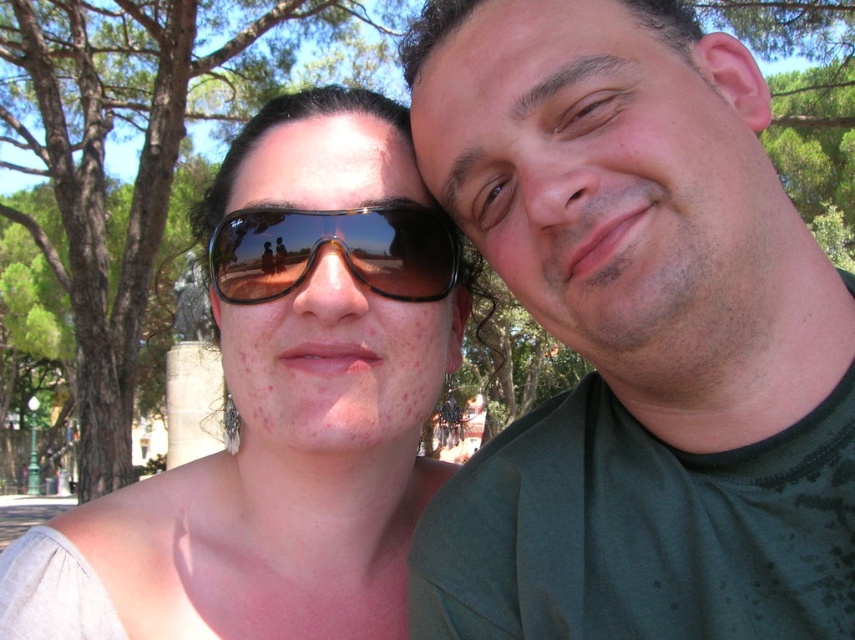
Question: Does green matte shirt at right appear under matte black sunglasses at upper left?

Choices:
 (A) no
 (B) yes

Answer: (A)

Question: Which point is closer to the camera?

Choices:
 (A) green matte shirt at right
 (B) matte black sunglasses at upper left
 (C) shiny black goggles at center

Answer: (A)

Question: Can you confirm if green matte shirt at right is positioned to the left of matte black sunglasses at upper left?

Choices:
 (A) yes
 (B) no

Answer: (B)

Question: Which of these objects is positioned closest to the shiny black goggles at center?

Choices:
 (A) green matte shirt at right
 (B) matte black sunglasses at upper left

Answer: (B)

Question: Is green matte shirt at right further to camera compared to shiny black goggles at center?

Choices:
 (A) no
 (B) yes

Answer: (A)

Question: Estimate the real-world distances between objects in this image. Which object is farther from the shiny black goggles at center?

Choices:
 (A) matte black sunglasses at upper left
 (B) green matte shirt at right

Answer: (B)